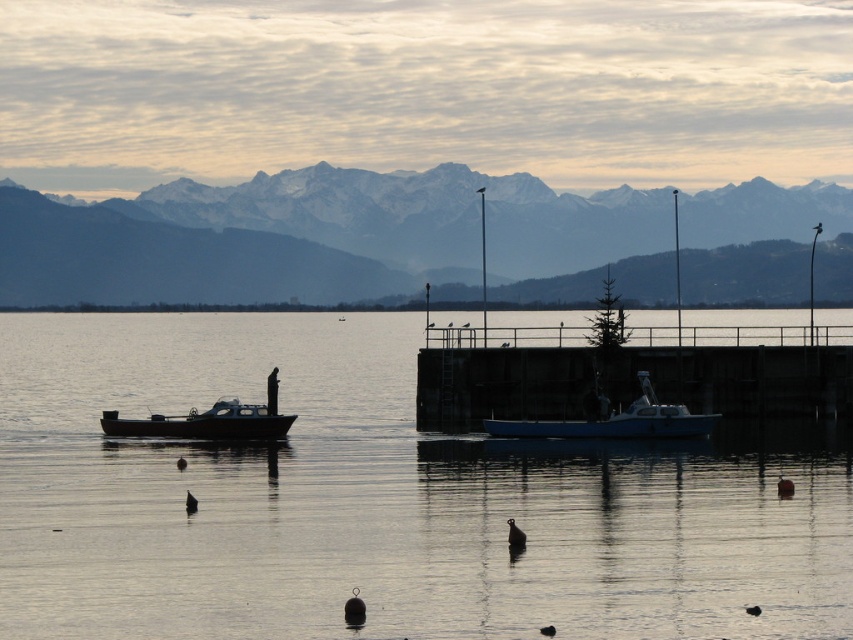
What is the exact location of the snowy mountain range at upper center in the image?

The snowy mountain range at upper center is located at point coordinates of (317, 236).